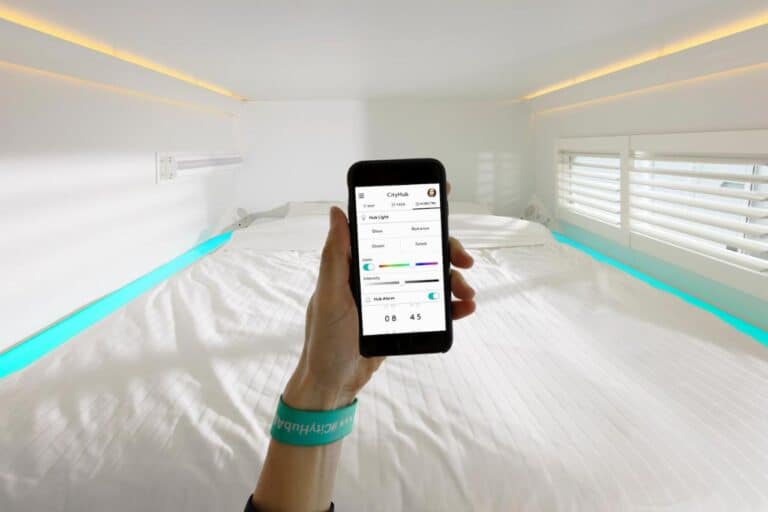
Image resolution: width=768 pixels, height=512 pixels. In order to click on wall in this screenshot , I will do `click(714, 102)`, `click(409, 133)`, `click(54, 193)`.